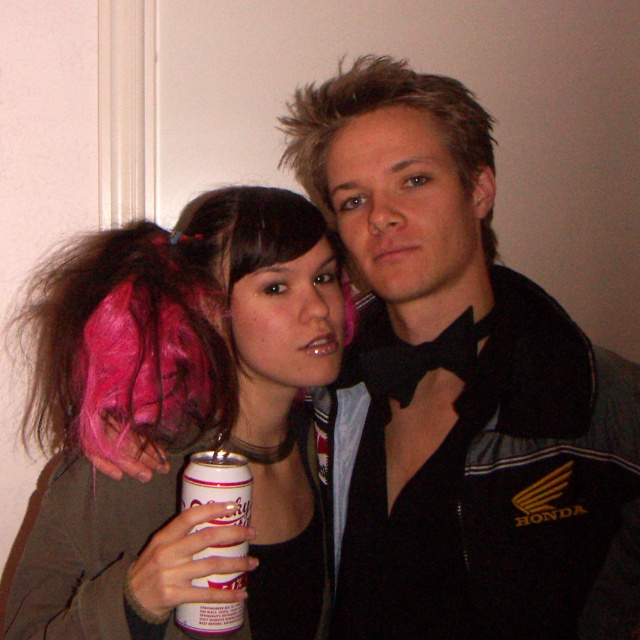
Question: Is pink fabric wig at left to the right of white matte can at center from the viewer's perspective?

Choices:
 (A) no
 (B) yes

Answer: (A)

Question: Can you confirm if pink fabric wig at left is positioned to the left of white matte can at center?

Choices:
 (A) no
 (B) yes

Answer: (B)

Question: Based on their relative distances, which object is nearer to the white matte can at center?

Choices:
 (A) pink fabric wig at upper left
 (B) pink fabric wig at left
 (C) black fabric bow tie at center

Answer: (A)

Question: Estimate the real-world distances between objects in this image. Which object is farther from the pink fabric wig at upper left?

Choices:
 (A) black fabric bow tie at center
 (B) pink fabric wig at left
 (C) white matte can at center

Answer: (A)

Question: Can you confirm if pink fabric wig at upper left is thinner than white matte can at center?

Choices:
 (A) no
 (B) yes

Answer: (A)

Question: Which of the following is the closest to the observer?

Choices:
 (A) (131, 257)
 (B) (388, 250)
 (C) (221, 481)

Answer: (C)